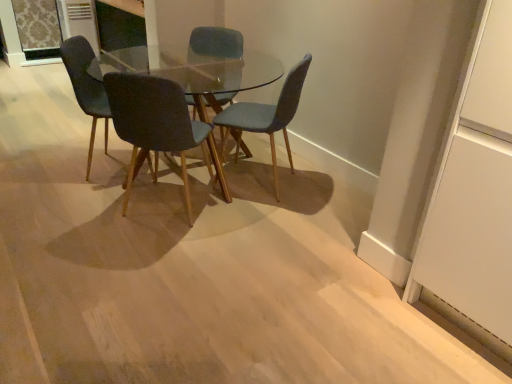
Identify the location of vacant area that lies between textured blue chair at center, arranged as the 1th chair when viewed from the right, and transparent glass door at upper right. (325, 226).